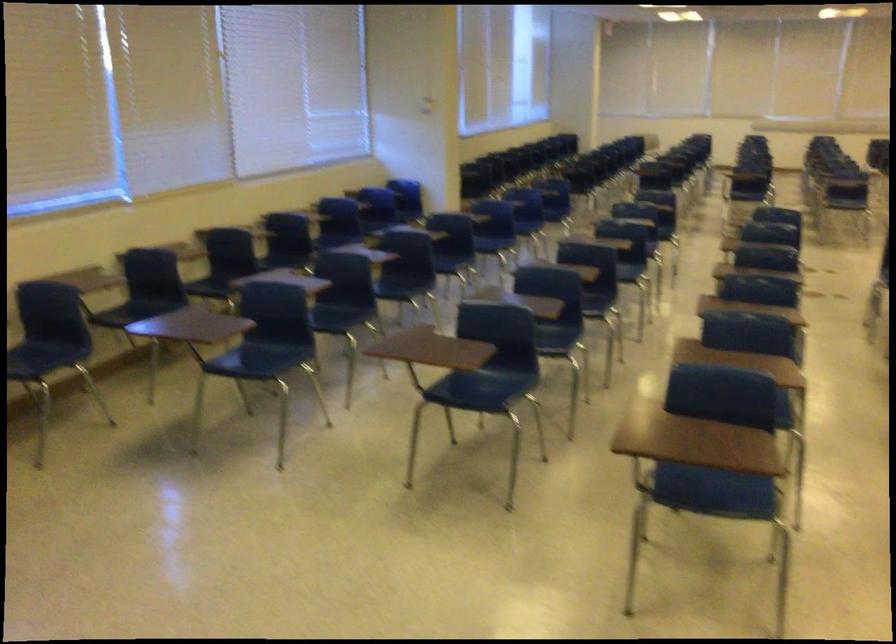
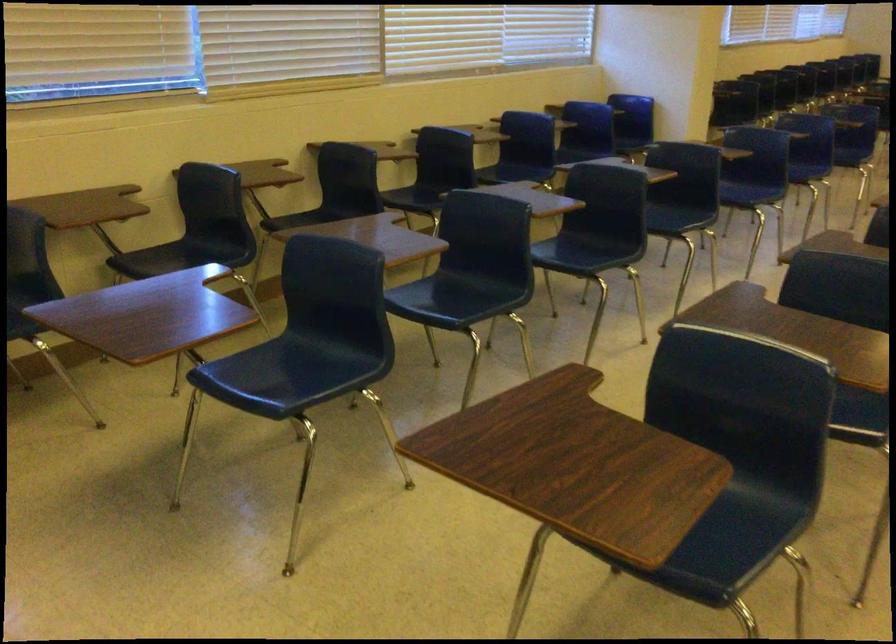
Find the pixel in the second image that matches the point at 339,313 in the first image.

(462, 292)